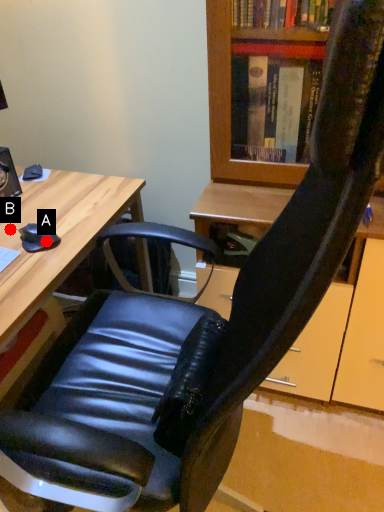
Question: Two points are circled on the image, labeled by A and B beside each circle. Which point is closer to the camera?

Choices:
 (A) A is closer
 (B) B is closer

Answer: (A)